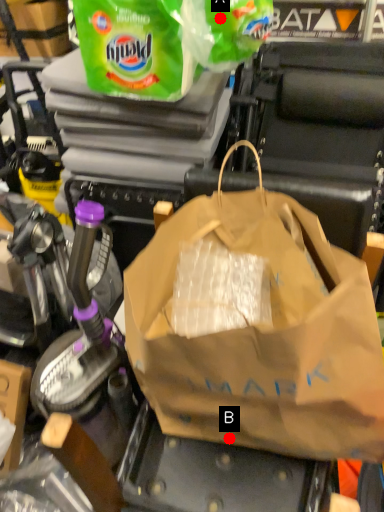
Question: Two points are circled on the image, labeled by A and B beside each circle. Which of the following is the closest to the observer?

Choices:
 (A) A is closer
 (B) B is closer

Answer: (B)